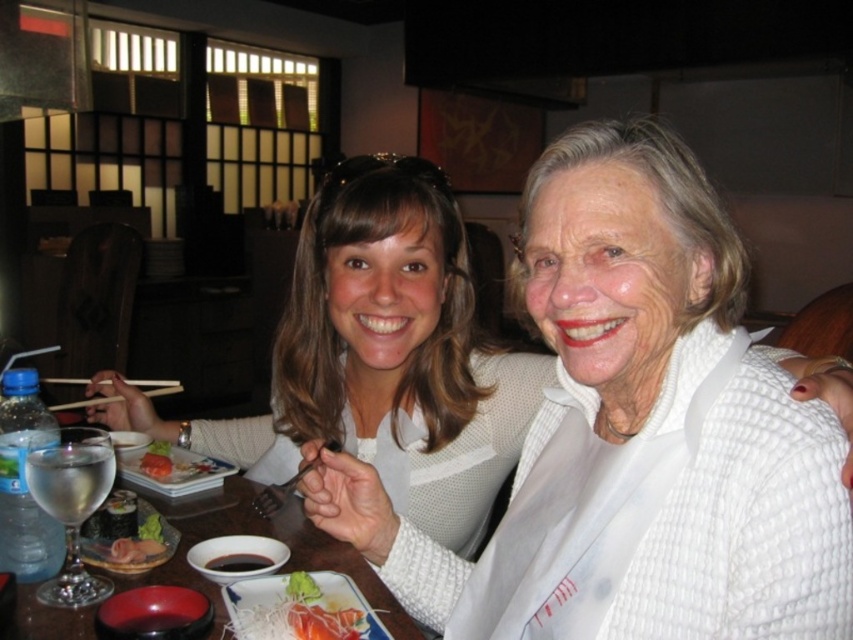
Is wooden table at center shorter than slightly translucent pinkish salmon at center?

No, wooden table at center is not shorter than slightly translucent pinkish salmon at center.

Is point (300, 561) farther from camera compared to point (264, 604)?

Yes, it is.

Locate an element on the screen. The height and width of the screenshot is (640, 853). wooden table at center is located at coordinates (260, 534).

Who is more distant from viewer, (596, 449) or (160, 465)?

Positioned behind is point (160, 465).

Who is taller, white textured sweater at center or salmon sashimi at center?

white textured sweater at center is taller.

This screenshot has width=853, height=640. What are the coordinates of `white textured sweater at center` in the screenshot? It's located at (633, 435).

Image resolution: width=853 pixels, height=640 pixels. In order to click on white textured sweater at center in this screenshot , I will do `click(633, 435)`.

Consider the image. Is wooden table at center further to the viewer compared to black glossy soy sauce at center?

No, it is not.

Is point (86, 616) positioned behind point (223, 556)?

That is False.

The image size is (853, 640). I want to click on wooden table at center, so click(260, 534).

This screenshot has width=853, height=640. What are the coordinates of `wooden table at center` in the screenshot? It's located at (260, 534).